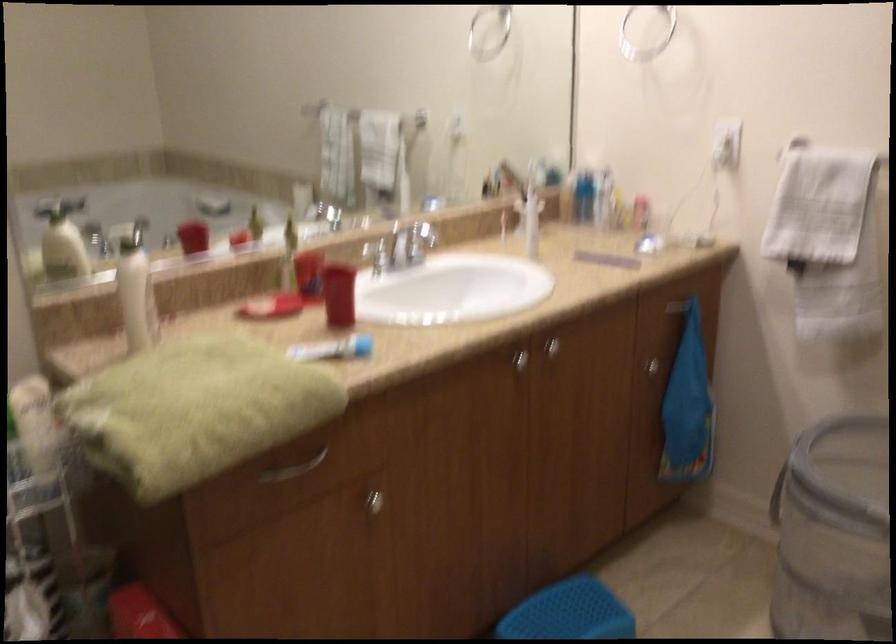
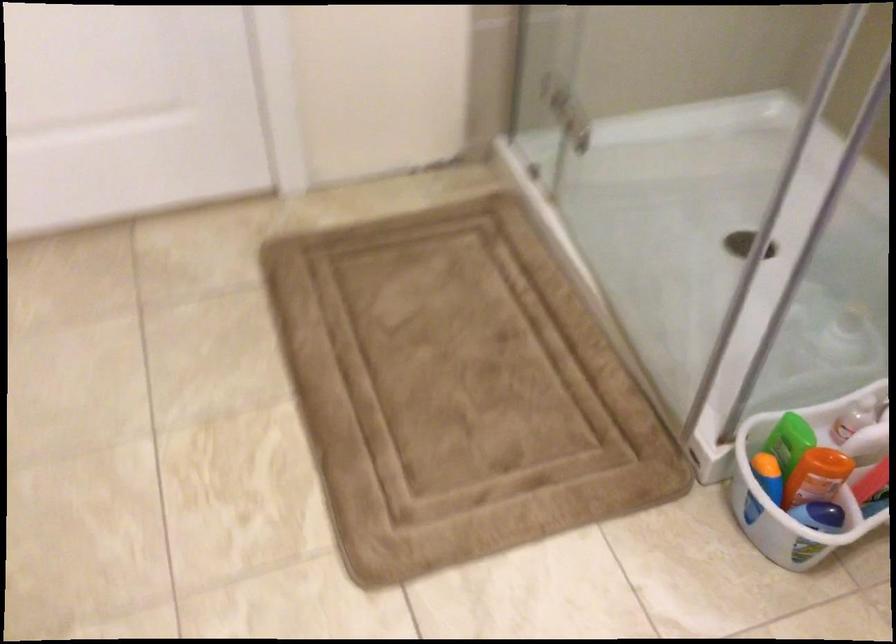
The first image is from the beginning of the video and the second image is from the end. How did the camera likely rotate when shooting the video?

The rotation direction of the camera is left-down.